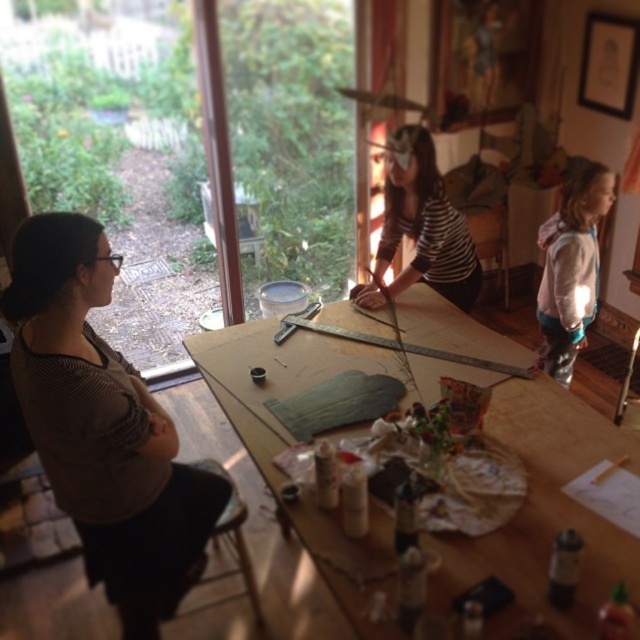
Question: Among these objects, which one is nearest to the camera?

Choices:
 (A) wooden stool at lower left
 (B) striped fabric at center
 (C) brown striped shirt at left

Answer: (C)

Question: Which is farther from the wooden table at center?

Choices:
 (A) striped fabric at center
 (B) white fleece jacket at right
 (C) wooden stool at lower left

Answer: (B)

Question: Is brown striped shirt at left thinner than wooden stool at lower left?

Choices:
 (A) yes
 (B) no

Answer: (B)

Question: Which point is farther from the camera taking this photo?

Choices:
 (A) (611, 524)
 (B) (234, 506)

Answer: (B)

Question: Does brown striped shirt at left have a larger size compared to white fleece jacket at right?

Choices:
 (A) yes
 (B) no

Answer: (A)

Question: Can you confirm if striped fabric at center is positioned below wooden stool at lower left?

Choices:
 (A) no
 (B) yes

Answer: (A)